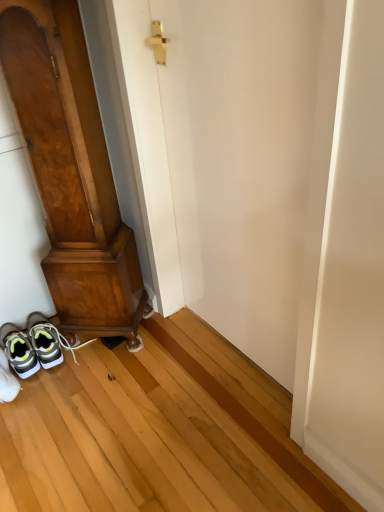
Locate an element on the screen. This screenshot has width=384, height=512. vacant space to the right of white mesh sneakers at lower left, marked as the 1th footwear in a front-to-back arrangement is located at coordinates (57, 384).